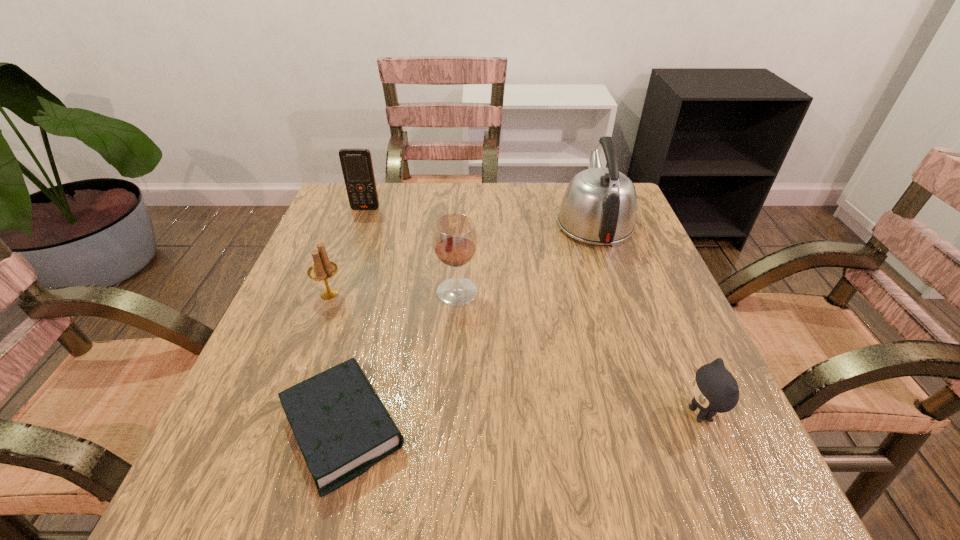
This screenshot has height=540, width=960. I want to click on free space that is in between the fourth object from left to right and the Bible, so click(x=400, y=360).

Locate an element on the screen. This screenshot has width=960, height=540. blank region between the shortest object and the kitten is located at coordinates (522, 421).

Locate an element on the screen. This screenshot has height=540, width=960. vacant area between the second shortest object and the fourth tallest object is located at coordinates (516, 354).

Identify the location of free space between the Bible and the third object from right to left. (400, 360).

You are a GUI agent. You are given a task and a screenshot of the screen. Output one action in this format:
    pyautogui.click(x=<x>, y=<y>)
    Task: Click on the vacant space that is in between the cellular telephone and the wineglass
    Image resolution: width=960 pixels, height=540 pixels.
    Given the screenshot: What is the action you would take?
    pyautogui.click(x=411, y=250)

Identify the location of free space between the tallest object and the Bible. The width and height of the screenshot is (960, 540). (468, 326).

The height and width of the screenshot is (540, 960). Identify the location of unoccupied position between the fourth object from left to right and the candle holder. (394, 293).

Find the location of a particular element. The height and width of the screenshot is (540, 960). vacant region between the candle holder and the kitten is located at coordinates (516, 354).

Identify the location of unoccupied position between the cellular telephone and the fifth tallest object. The width and height of the screenshot is (960, 540). (533, 312).

Where is `vacant area that lies between the kitten and the Bible`? vacant area that lies between the kitten and the Bible is located at coordinates (522, 421).